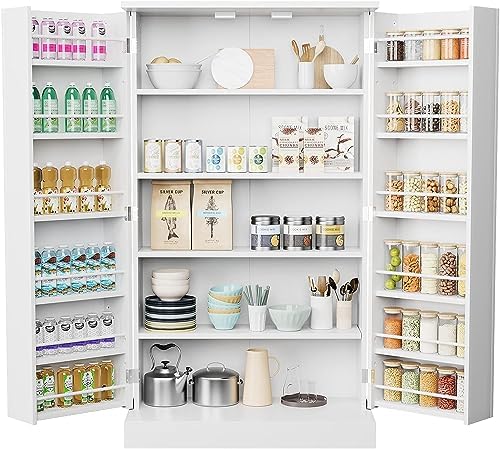
Find the location of `glass jars on the fourth shelf`. glass jars on the fourth shelf is located at coordinates (395, 261), (409, 262), (428, 264), (448, 264), (465, 265).